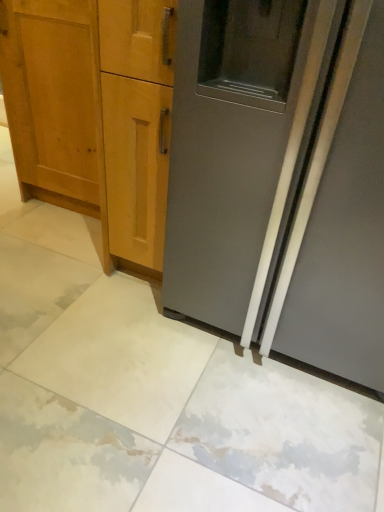
Consider the image. What is the approximate width of light brown wood cabinet at left?

32.79 centimeters.

At what (x,y) coordinates should I click in order to perform the action: click on light brown wood cabinet at left. Please return your answer as a coordinate pair (x, y). This screenshot has height=512, width=384. Looking at the image, I should click on (94, 113).

Describe the element at coordinates (94, 113) in the screenshot. I see `light brown wood cabinet at left` at that location.

This screenshot has height=512, width=384. Describe the element at coordinates (280, 179) in the screenshot. I see `satin gray refrigerator at right` at that location.

What is the approximate height of satin gray refrigerator at right?

It is 1.14 meters.

This screenshot has width=384, height=512. I want to click on satin gray refrigerator at right, so click(280, 179).

You are a GUI agent. You are given a task and a screenshot of the screen. Output one action in this format:
    pyautogui.click(x=<x>, y=<y>)
    Task: Click on the light brown wood cabinet at left
    This screenshot has height=512, width=384.
    Given the screenshot: What is the action you would take?
    pyautogui.click(x=94, y=113)

Which object is positioned more to the left, satin gray refrigerator at right or light brown wood cabinet at left?

light brown wood cabinet at left is more to the left.

Considering their positions, is satin gray refrigerator at right located in front of or behind light brown wood cabinet at left?

In the image, satin gray refrigerator at right appears in front of light brown wood cabinet at left.

Is point (377, 352) positioned before point (161, 61)?

No, it is behind (161, 61).

From the image's perspective, is satin gray refrigerator at right on top of light brown wood cabinet at left?

No.

From a real-world perspective, is satin gray refrigerator at right physically located above or below light brown wood cabinet at left?

In terms of real-world spatial position, satin gray refrigerator at right is above light brown wood cabinet at left.

Considering the sizes of satin gray refrigerator at right and light brown wood cabinet at left in the image, is satin gray refrigerator at right wider or thinner than light brown wood cabinet at left?

satin gray refrigerator at right is wider than light brown wood cabinet at left.

Consider the image. Which of these two, satin gray refrigerator at right or light brown wood cabinet at left, stands shorter?

light brown wood cabinet at left is shorter.

Which of these two, satin gray refrigerator at right or light brown wood cabinet at left, is smaller?

Smaller between the two is light brown wood cabinet at left.

Which is correct: satin gray refrigerator at right is inside light brown wood cabinet at left, or outside of it?

satin gray refrigerator at right exists outside the volume of light brown wood cabinet at left.

Are satin gray refrigerator at right and light brown wood cabinet at left beside each other?

No, satin gray refrigerator at right is not touching light brown wood cabinet at left.

Is satin gray refrigerator at right looking in the opposite direction of light brown wood cabinet at left?

satin gray refrigerator at right does not have its back to light brown wood cabinet at left.

Measure the distance between satin gray refrigerator at right and light brown wood cabinet at left.

The distance of satin gray refrigerator at right from light brown wood cabinet at left is 38.27 inches.

In the image, there is a light brown wood cabinet at left. Identify the location of door below it (from the image's perspective). This screenshot has width=384, height=512. (280, 179).

Is light brown wood cabinet at left to the left of satin gray refrigerator at right from the viewer's perspective?

Correct, you'll find light brown wood cabinet at left to the left of satin gray refrigerator at right.

Based on the photo, does light brown wood cabinet at left lie in front of satin gray refrigerator at right?

No, light brown wood cabinet at left is further to the viewer.

Which is closer to the camera, (101, 124) or (378, 181)?

The point (378, 181) is closer to the camera.

Based on the photo, from the image's perspective, is light brown wood cabinet at left located above or below satin gray refrigerator at right?

light brown wood cabinet at left is above satin gray refrigerator at right.

From a real-world perspective, is light brown wood cabinet at left positioned above or below satin gray refrigerator at right?

Clearly, from a real-world perspective, light brown wood cabinet at left is below satin gray refrigerator at right.

Is light brown wood cabinet at left wider than satin gray refrigerator at right?

In fact, light brown wood cabinet at left might be narrower than satin gray refrigerator at right.

Does light brown wood cabinet at left have a greater height compared to satin gray refrigerator at right?

Incorrect, the height of light brown wood cabinet at left is not larger of that of satin gray refrigerator at right.

Is light brown wood cabinet at left bigger or smaller than satin gray refrigerator at right?

Clearly, light brown wood cabinet at left is smaller in size than satin gray refrigerator at right.

Is satin gray refrigerator at right surrounded by light brown wood cabinet at left?

Actually, satin gray refrigerator at right is outside light brown wood cabinet at left.

Are light brown wood cabinet at left and satin gray refrigerator at right making contact?

No, light brown wood cabinet at left is not touching satin gray refrigerator at right.

Is light brown wood cabinet at left aimed at satin gray refrigerator at right?

No, light brown wood cabinet at left is not facing towards satin gray refrigerator at right.

The image size is (384, 512). Identify the location of door positioned vertically above the light brown wood cabinet at left (from a real-world perspective). (280, 179).

Where is `cabinetry above the satin gray refrigerator at right (from the image's perspective)`? This screenshot has width=384, height=512. cabinetry above the satin gray refrigerator at right (from the image's perspective) is located at coordinates pyautogui.click(x=94, y=113).

This screenshot has width=384, height=512. Find the location of `door located in front of the light brown wood cabinet at left`. door located in front of the light brown wood cabinet at left is located at coordinates (280, 179).